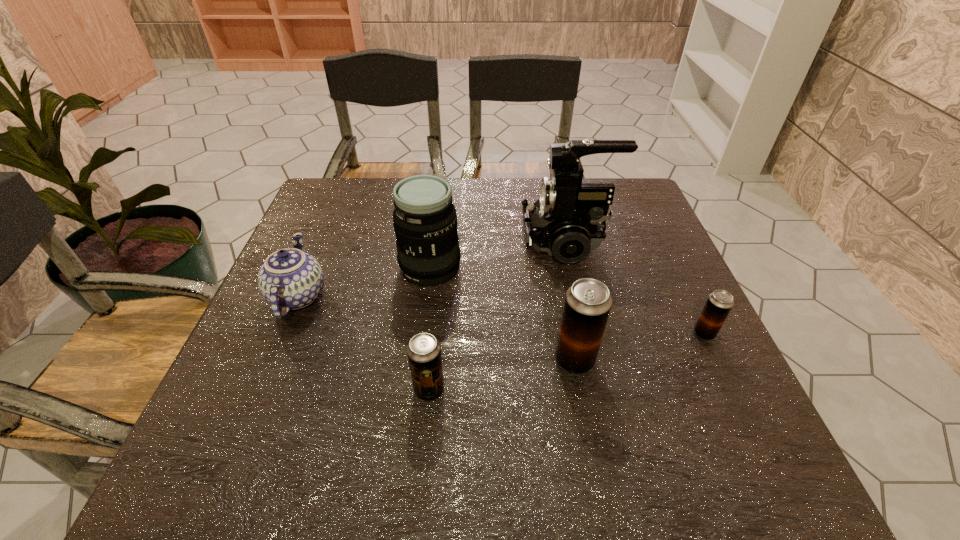
Locate an element on the screen. Image resolution: width=960 pixels, height=540 pixels. beer can that is at the right edge is located at coordinates (719, 303).

Where is `camcorder that is at the right edge`? The height and width of the screenshot is (540, 960). camcorder that is at the right edge is located at coordinates (567, 221).

Identify the location of object situated at the far right corner. This screenshot has width=960, height=540. (567, 221).

What are the coordinates of `vacant space at the far edge` in the screenshot? It's located at (392, 190).

Image resolution: width=960 pixels, height=540 pixels. Identify the location of vacant space at the near edge. (495, 417).

This screenshot has width=960, height=540. In the image, there is a desktop. Find the location of `vacant space at the right edge`. vacant space at the right edge is located at coordinates (691, 363).

Where is `free space between the shortest object and the third tallest object`? The width and height of the screenshot is (960, 540). free space between the shortest object and the third tallest object is located at coordinates (639, 347).

The width and height of the screenshot is (960, 540). I want to click on vacant area between the tallest beer can and the leftmost object, so click(437, 328).

Where is `free space between the third tallest object and the telephoto lens`? The image size is (960, 540). free space between the third tallest object and the telephoto lens is located at coordinates (502, 314).

Identify the location of free space between the shortest beer can and the tallest beer can. The width and height of the screenshot is (960, 540). (639, 347).